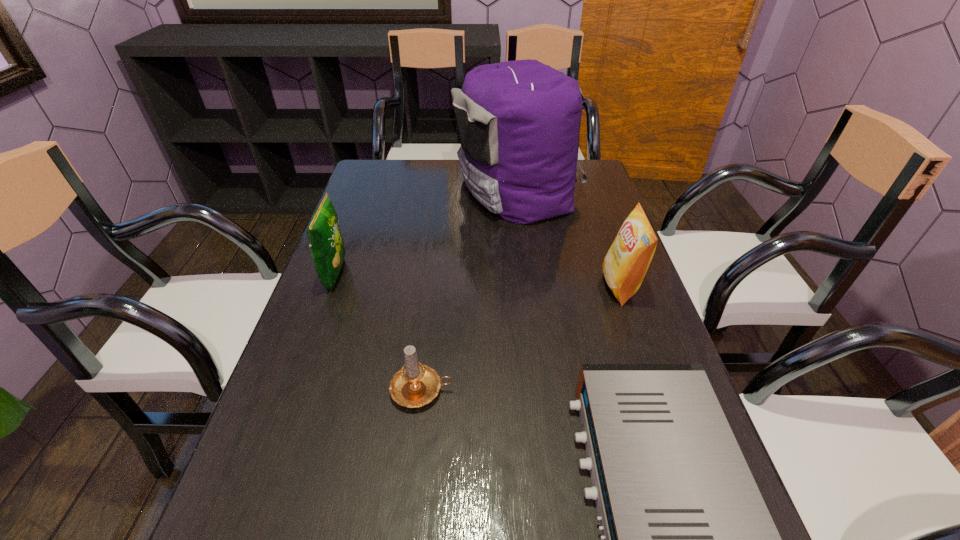
Identify the location of blank space located on the front-facing side of the right crisp (potato chip). (531, 286).

The width and height of the screenshot is (960, 540). What are the coordinates of `free space located on the front-facing side of the right crisp (potato chip)` in the screenshot? It's located at (551, 286).

Where is `vacant space positioned on the front of the second shortest object`? This screenshot has width=960, height=540. vacant space positioned on the front of the second shortest object is located at coordinates (414, 458).

I want to click on object located at the far edge, so click(x=518, y=122).

This screenshot has height=540, width=960. I want to click on object located in the left edge section of the desktop, so click(326, 244).

Image resolution: width=960 pixels, height=540 pixels. What are the coordinates of `backpack that is at the right edge` in the screenshot? It's located at (518, 122).

Where is `crisp (potato chip) that is positioned at the right edge`? This screenshot has height=540, width=960. crisp (potato chip) that is positioned at the right edge is located at coordinates (626, 262).

You are a GUI agent. You are given a task and a screenshot of the screen. Output one action in this format:
    pyautogui.click(x=<x>, y=<y>)
    Task: Click on the object situated at the far right corner
    
    Given the screenshot: What is the action you would take?
    pyautogui.click(x=518, y=122)

I want to click on vacant space at the left edge, so click(x=298, y=492).

In the image, there is a desktop. Identify the location of free space at the right edge. This screenshot has width=960, height=540. (571, 238).